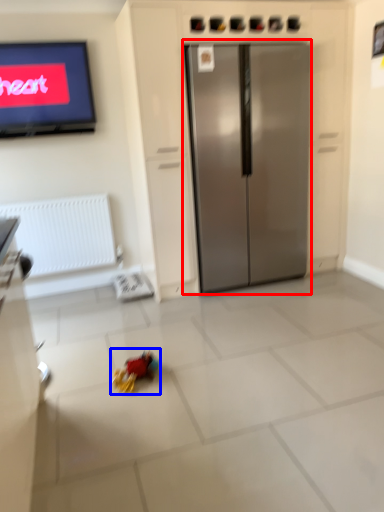
Question: Which object appears farthest to the camera in this image, refrigerator (highlighted by a red box) or miniature (highlighted by a blue box)?

Choices:
 (A) refrigerator
 (B) miniature

Answer: (A)